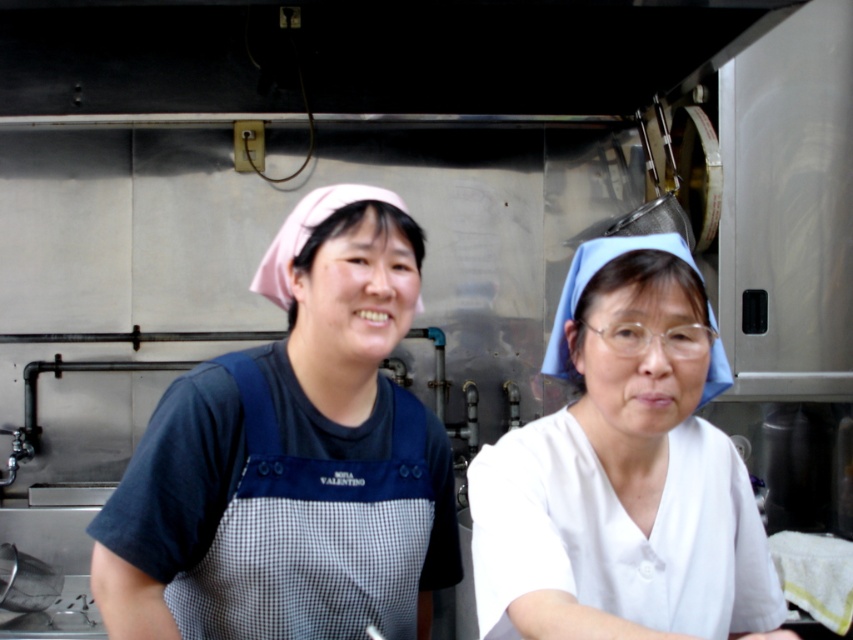
Question: Is white fabric at center in front of black checkered apron at center?

Choices:
 (A) no
 (B) yes

Answer: (B)

Question: Is the position of white fabric at center less distant than that of black checkered apron at center?

Choices:
 (A) yes
 (B) no

Answer: (A)

Question: Does white fabric at center lie behind black checkered apron at center?

Choices:
 (A) no
 (B) yes

Answer: (A)